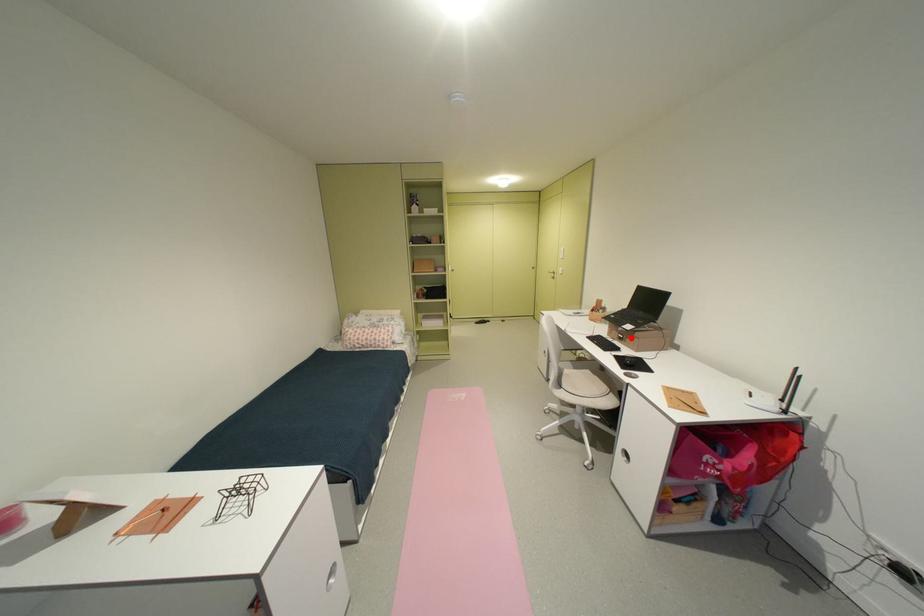
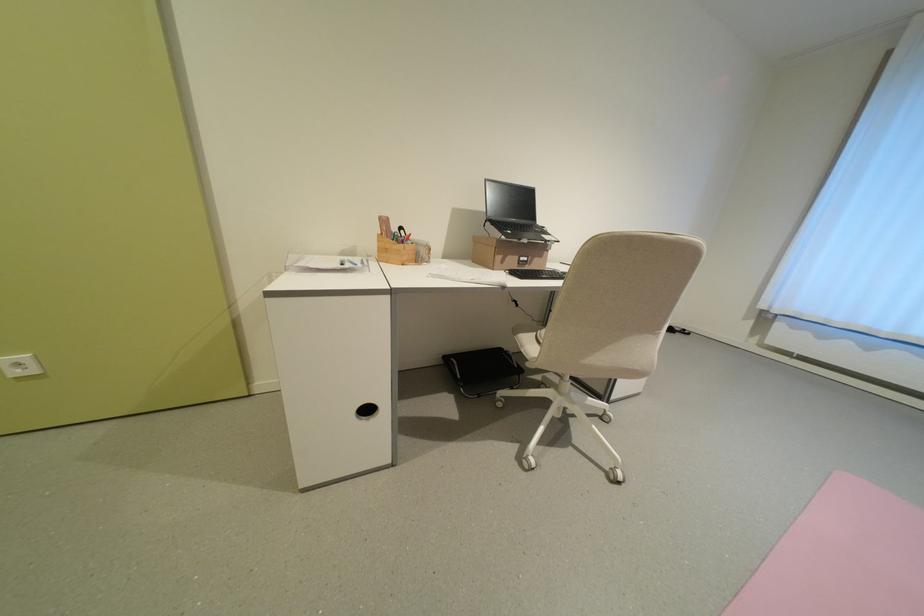
Where in the second image is the point corresponding to the highlighted location from the first image?

(536, 261)